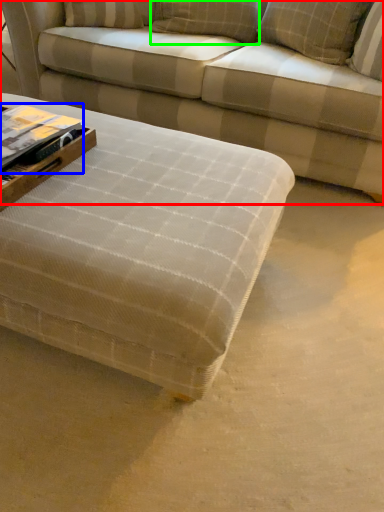
Question: Based on their relative distances, which object is farther from studio couch (highlighted by a red box)? Choose from book (highlighted by a blue box) and pillow (highlighted by a green box).

Choices:
 (A) book
 (B) pillow

Answer: (A)